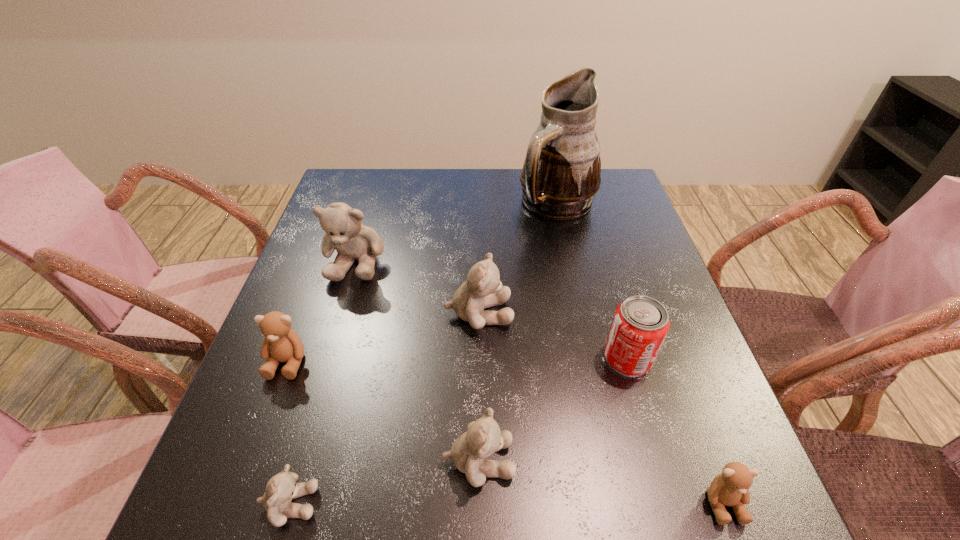
Image resolution: width=960 pixels, height=540 pixels. What are the coordinates of `vacant space at the right edge of the desktop` in the screenshot? It's located at [684, 430].

The height and width of the screenshot is (540, 960). In order to click on vacant region at the far left corner of the desktop in this screenshot , I will do click(342, 191).

Locate an element on the screen. This screenshot has width=960, height=540. vacant space in between the can and the farthest gray teddy bear is located at coordinates (492, 310).

Where is `vacant region between the bigger brown teddy bear and the third biggest gray teddy bear`? This screenshot has height=540, width=960. vacant region between the bigger brown teddy bear and the third biggest gray teddy bear is located at coordinates (383, 411).

Identify the location of empty location between the smallest gray teddy bear and the can. (459, 431).

The width and height of the screenshot is (960, 540). Find the location of `blank region between the second smallest gray teddy bear and the brown pitcher`. blank region between the second smallest gray teddy bear and the brown pitcher is located at coordinates (517, 332).

You are a GUI agent. You are given a task and a screenshot of the screen. Output one action in this format:
    pyautogui.click(x=<x>, y=<y>)
    Task: Click on the vacant area that lies between the smallest gray teddy bear and the second farthest object
    The width and height of the screenshot is (960, 540).
    Given the screenshot: What is the action you would take?
    pyautogui.click(x=323, y=382)

Locate an element on the screen. The width and height of the screenshot is (960, 540). free space between the farthest object and the second smallest gray teddy bear is located at coordinates (517, 332).

Find the location of a particular element. This screenshot has height=540, width=960. free space between the can and the second tallest teddy bear is located at coordinates (553, 336).

At what (x,y) coordinates should I click in order to perform the action: click on empty space between the can and the seventh nearest object. Please return your answer as a coordinate pair (x, y). Looking at the image, I should click on (492, 310).